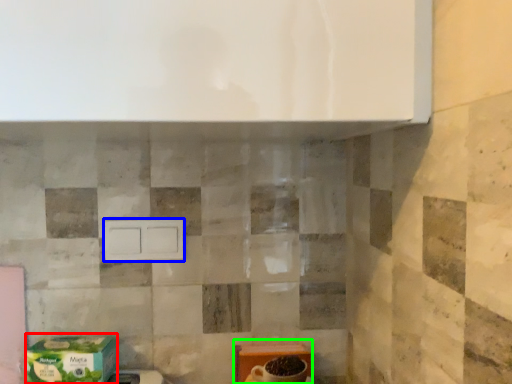
Question: Which is nearer to the cardboard box (highlighted by a red box)? drawer (highlighted by a blue box) or cardboard box (highlighted by a green box).

Choices:
 (A) drawer
 (B) cardboard box

Answer: (A)